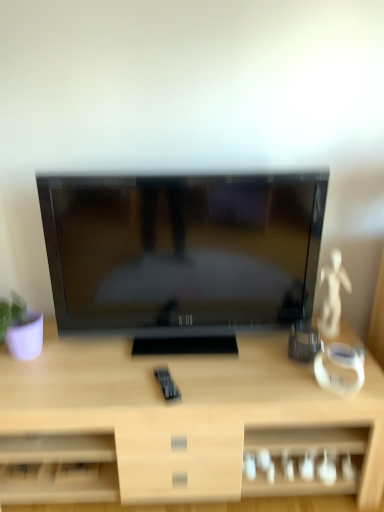
At what (x,y) coordinates should I click in order to perform the action: click on blank space situated above matte black tv at center (from a real-world perspective). Please return your answer as a coordinate pair (x, y). Looking at the image, I should click on (196, 182).